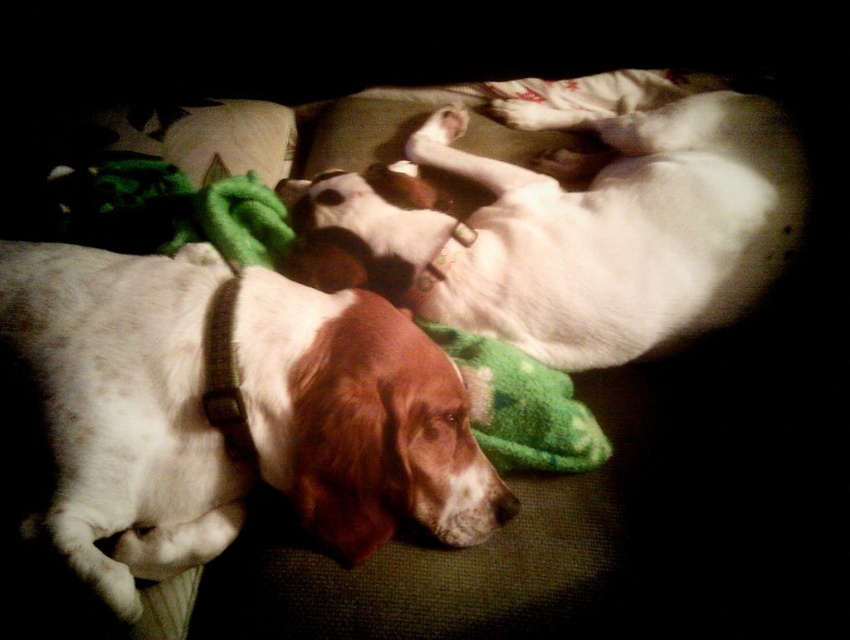
Is white fur dog at center smaller than white fur dog at upper center?

Yes, white fur dog at center is smaller than white fur dog at upper center.

The width and height of the screenshot is (850, 640). In order to click on white fur dog at center in this screenshot , I will do `click(244, 412)`.

The width and height of the screenshot is (850, 640). Identify the location of white fur dog at center. (244, 412).